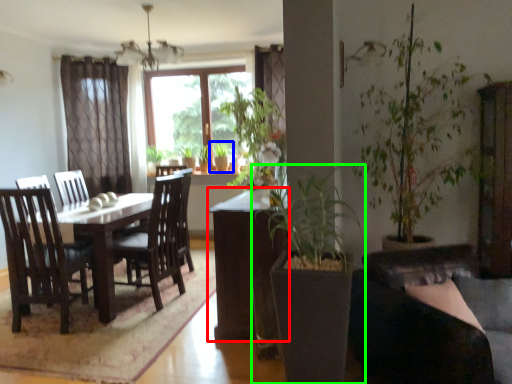
Question: Estimate the real-world distances between objects in this image. Which object is closer to table (highlighted by a red box), houseplant (highlighted by a blue box) or houseplant (highlighted by a green box)?

Choices:
 (A) houseplant
 (B) houseplant

Answer: (B)